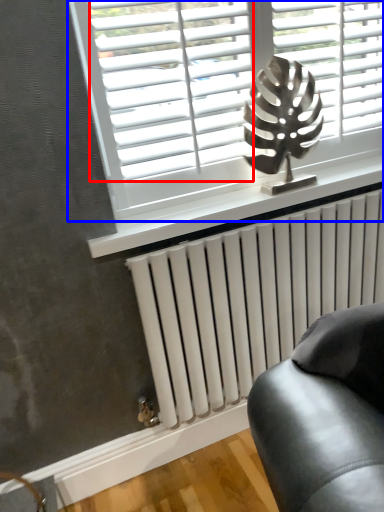
Question: Which object appears closest to the camera in this image, blind (highlighted by a red box) or window (highlighted by a blue box)?

Choices:
 (A) blind
 (B) window

Answer: (A)